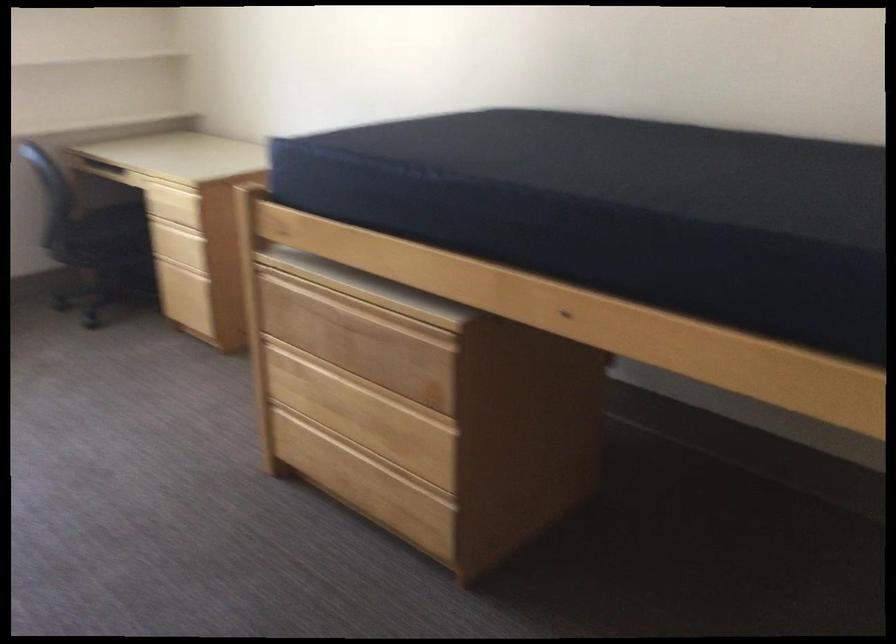
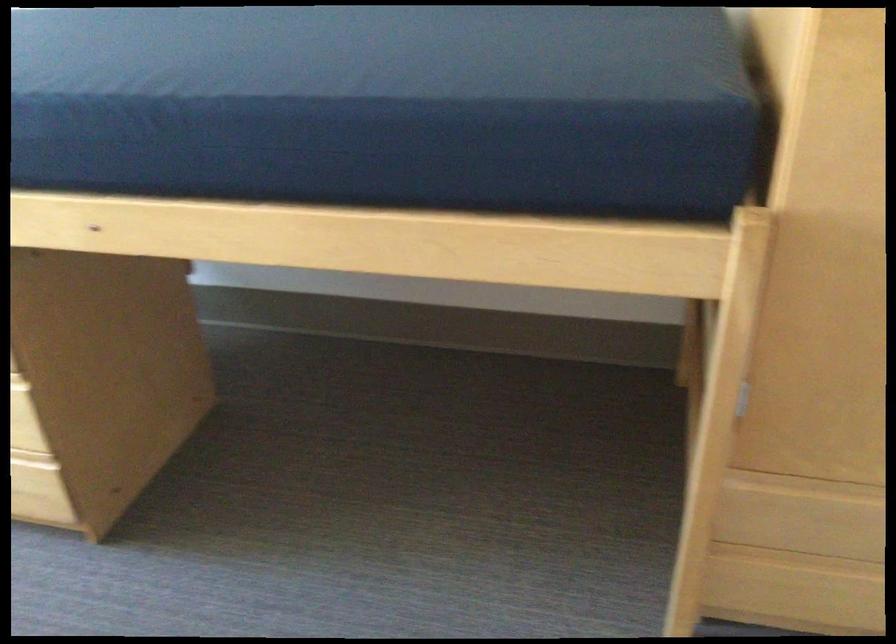
Question: The camera is either moving clockwise (left) or counter-clockwise (right) around the object. The first image is from the beginning of the video and the second image is from the end. Is the camera moving left or right when shooting the video?

Choices:
 (A) Left
 (B) Right

Answer: (A)